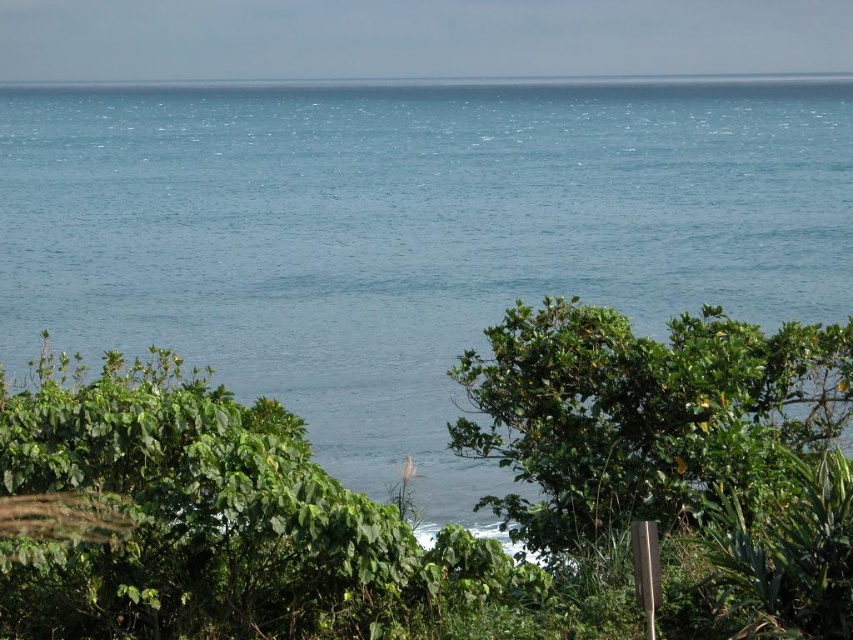
Between point (592, 292) and point (596, 428), which one is positioned in front?

Point (596, 428) is more forward.

Consider the image. Does blue water at center come in front of green leafy tree at center?

No, it is behind green leafy tree at center.

Is point (177, 109) closer to camera compared to point (624, 426)?

No, (177, 109) is behind (624, 426).

The width and height of the screenshot is (853, 640). In order to click on blue water at center in this screenshot , I will do `click(408, 234)`.